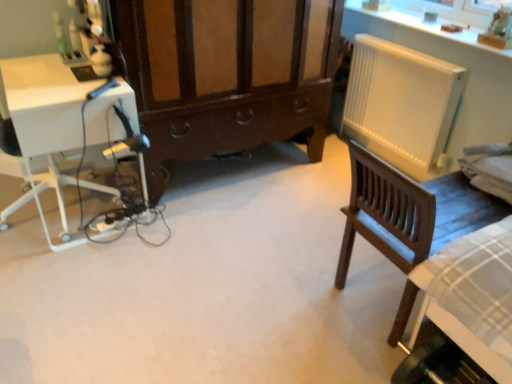
Question: From the image's perspective, relative to white plastic radiator at right, is white plastic computer desk at left above or below?

Choices:
 (A) below
 (B) above

Answer: (A)

Question: From a real-world perspective, is white plastic computer desk at left above or below white plastic radiator at right?

Choices:
 (A) below
 (B) above

Answer: (A)

Question: Based on their relative distances, which object is nearer to the brown wood cabinet at center?

Choices:
 (A) white plastic radiator at right
 (B) dark wood chair at right
 (C) white plastic computer desk at left

Answer: (C)

Question: Which is farther from the brown wood cabinet at center?

Choices:
 (A) dark wood chair at right
 (B) white plastic radiator at right
 (C) white plastic computer desk at left

Answer: (A)